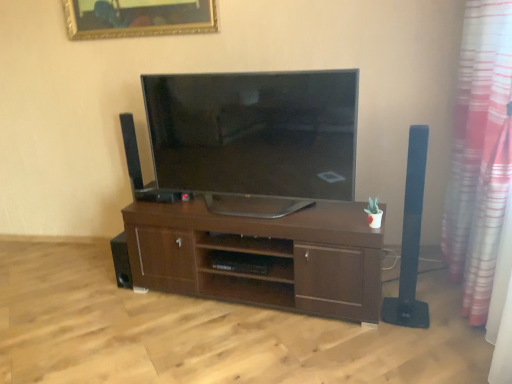
Find the location of `black matte speaker at right, which is the 3th speaker in left-to-right order`. black matte speaker at right, which is the 3th speaker in left-to-right order is located at coordinates (411, 238).

This screenshot has width=512, height=384. Describe the element at coordinates (140, 169) in the screenshot. I see `black matte speaker at left, which is the first speaker in back-to-front order` at that location.

Identify the location of black matte speaker at left, which is the first speaker in back-to-front order. (140, 169).

Describe the element at coordinates (121, 261) in the screenshot. I see `black matte speaker at lower left, positioned as the second speaker in back-to-front order` at that location.

What do you see at coordinates (261, 257) in the screenshot? This screenshot has height=384, width=512. I see `brown wood cabinet at center` at bounding box center [261, 257].

This screenshot has width=512, height=384. What are the coordinates of `black matte speaker at right, which is the 3th speaker in left-to-right order` in the screenshot? It's located at [x=411, y=238].

Based on the photo, does black matte speaker at left, positioned as the 3th speaker in front-to-back order, come in front of black matte speaker at lower left, positioned as the second speaker in back-to-front order?

No, black matte speaker at left, positioned as the 3th speaker in front-to-back order, is further to the viewer.

Identify the location of the 1st speaker to the right of the black matte speaker at lower left, positioned as the second speaker in back-to-front order, starting your count from the anchor. This screenshot has width=512, height=384. (140, 169).

Can you confirm if black matte speaker at left, which is the first speaker in back-to-front order, is wider than black matte speaker at lower left, which appears as the 1th speaker when viewed from the left?

Yes, black matte speaker at left, which is the first speaker in back-to-front order, is wider than black matte speaker at lower left, which appears as the 1th speaker when viewed from the left.

Could you tell me if black matte speaker at left, positioned as the 3th speaker in front-to-back order, is facing black matte speaker at lower left, acting as the 3th speaker starting from the right?

No, black matte speaker at left, positioned as the 3th speaker in front-to-back order, is not aimed at black matte speaker at lower left, acting as the 3th speaker starting from the right.

From a real-world perspective, is gold-framed mirror at upper center located beneath brown wood shelf at center?

No.

From the image's perspective, which one is positioned lower, gold-framed mirror at upper center or brown wood shelf at center?

brown wood shelf at center, from the image's perspective.

Which of these two, gold-framed mirror at upper center or brown wood shelf at center, is thinner?

Thinner between the two is gold-framed mirror at upper center.

Is gold-framed mirror at upper center in front of brown wood shelf at center?

No, gold-framed mirror at upper center is further to the viewer.

Could you tell me if satin black tv at center is turned towards pink striped curtain at right?

No, satin black tv at center does not turn towards pink striped curtain at right.

From the image's perspective, is satin black tv at center beneath pink striped curtain at right?

No, from the image's perspective, satin black tv at center is not beneath pink striped curtain at right.

Looking at this image, is satin black tv at center not near pink striped curtain at right?

satin black tv at center is positioned a significant distance from pink striped curtain at right.

Measure the distance from satin black tv at center to pink striped curtain at right.

1.09 meters.

From the picture: What's the angular difference between brown wood cabinet at center and black matte speaker at right, which is the first speaker in front-to-back order,'s facing directions?

The facing directions of brown wood cabinet at center and black matte speaker at right, which is the first speaker in front-to-back order, are 0.884 degrees apart.

This screenshot has height=384, width=512. There is a brown wood cabinet at center. In order to click on the 1st speaker above it (from the image's perspective) in this screenshot , I will do `click(411, 238)`.

Does brown wood cabinet at center have a greater width compared to black matte speaker at right, which is the 3th speaker in back-to-front order?

Indeed, brown wood cabinet at center has a greater width compared to black matte speaker at right, which is the 3th speaker in back-to-front order.

Between black matte speaker at left, positioned as the 3th speaker in front-to-back order, and satin black tv at center, which one has smaller size?

black matte speaker at left, positioned as the 3th speaker in front-to-back order.

Is black matte speaker at left, which appears as the second speaker when viewed from the right, next to satin black tv at center and touching it?

No, black matte speaker at left, which appears as the second speaker when viewed from the right, is not making contact with satin black tv at center.

Which of these two, black matte speaker at left, which appears as the second speaker when viewed from the right, or satin black tv at center, is thinner?

Thinner between the two is black matte speaker at left, which appears as the second speaker when viewed from the right.

Between black matte speaker at left, marked as the 2th speaker in a left-to-right arrangement, and satin black tv at center, which one has less height?

black matte speaker at left, marked as the 2th speaker in a left-to-right arrangement, is shorter.

Does gold-framed mirror at upper center have a smaller size compared to satin black tv at center?

Yes.

Measure the distance between gold-framed mirror at upper center and satin black tv at center.

gold-framed mirror at upper center is 36.64 inches from satin black tv at center.

From the image's perspective, is gold-framed mirror at upper center above or below satin black tv at center?

From the image's perspective, gold-framed mirror at upper center appears above satin black tv at center.

In terms of width, does gold-framed mirror at upper center look wider or thinner when compared to satin black tv at center?

gold-framed mirror at upper center is thinner than satin black tv at center.

Is black matte speaker at right, which is the 3th speaker in left-to-right order, with brown wood cabinet at center?

No, black matte speaker at right, which is the 3th speaker in left-to-right order, is not in contact with brown wood cabinet at center.

Which object is closer to the camera, black matte speaker at right, which is the 3th speaker in left-to-right order, or brown wood cabinet at center?

black matte speaker at right, which is the 3th speaker in left-to-right order, is in front.

Can you confirm if black matte speaker at right, which is the first speaker in front-to-back order, is positioned to the left of brown wood cabinet at center?

In fact, black matte speaker at right, which is the first speaker in front-to-back order, is to the right of brown wood cabinet at center.

Is black matte speaker at right, which is the 3th speaker in left-to-right order, positioned with its back to brown wood cabinet at center?

black matte speaker at right, which is the 3th speaker in left-to-right order, is not turned away from brown wood cabinet at center.

At what (x,y) coordinates should I click in order to perform the action: click on the 2nd speaker located above the black matte speaker at lower left, acting as the 3th speaker starting from the right (from a real-world perspective). Please return your answer as a coordinate pair (x, y). Looking at the image, I should click on (140, 169).

Image resolution: width=512 pixels, height=384 pixels. Find the location of `picture frame that appears behind the brown wood shelf at center`. picture frame that appears behind the brown wood shelf at center is located at coordinates (138, 18).

Based on the photo, from the image, which object appears to be nearer to black matte speaker at left, positioned as the 3th speaker in front-to-back order, gold-framed mirror at upper center or brown wood cabinet at center?

brown wood cabinet at center.

From the image, which object appears to be nearer to brown wood shelf at center, gold-framed mirror at upper center or brown wood cabinet at center?

Among the two, brown wood cabinet at center is located nearer to brown wood shelf at center.

From the image, which object appears to be farther from black matte speaker at lower left, positioned as the second speaker in back-to-front order, brown wood shelf at center or black matte speaker at right, which is the 3th speaker in left-to-right order?

black matte speaker at right, which is the 3th speaker in left-to-right order, is positioned further to the anchor black matte speaker at lower left, positioned as the second speaker in back-to-front order.

From the image, which object appears to be nearer to pink striped curtain at right, satin black tv at center or brown wood shelf at center?

Based on the image, satin black tv at center appears to be nearer to pink striped curtain at right.

Which object lies nearer to the anchor point brown wood cabinet at center, black matte speaker at right, which is the 3th speaker in back-to-front order, or brown wood shelf at center?

brown wood shelf at center lies closer to brown wood cabinet at center than the other object.

From the image, which object appears to be nearer to pink striped curtain at right, brown wood cabinet at center or gold-framed mirror at upper center?

The object closer to pink striped curtain at right is brown wood cabinet at center.

Which object lies further to the anchor point brown wood shelf at center, black matte speaker at right, which is the 3th speaker in left-to-right order, or pink striped curtain at right?

pink striped curtain at right is positioned further to the anchor brown wood shelf at center.

Considering their positions, is pink striped curtain at right positioned closer to black matte speaker at right, which is the 3th speaker in left-to-right order, than satin black tv at center?

pink striped curtain at right.

Find the location of a particular element. cabinetry between satin black tv at center and brown wood shelf at center vertically is located at coordinates (261, 257).

You are a GUI agent. You are given a task and a screenshot of the screen. Output one action in this format:
    pyautogui.click(x=<x>, y=<y>)
    Task: Click on the television between gold-framed mirror at upper center and black matte speaker at left, which is the first speaker in back-to-front order, vertically
    The width and height of the screenshot is (512, 384).
    Given the screenshot: What is the action you would take?
    click(x=255, y=132)

This screenshot has width=512, height=384. I want to click on television situated between gold-framed mirror at upper center and pink striped curtain at right from left to right, so click(255, 132).

Locate an element on the screen. The width and height of the screenshot is (512, 384). shelf located between black matte speaker at left, marked as the 2th speaker in a left-to-right arrangement, and satin black tv at center in the left-right direction is located at coordinates (245, 263).